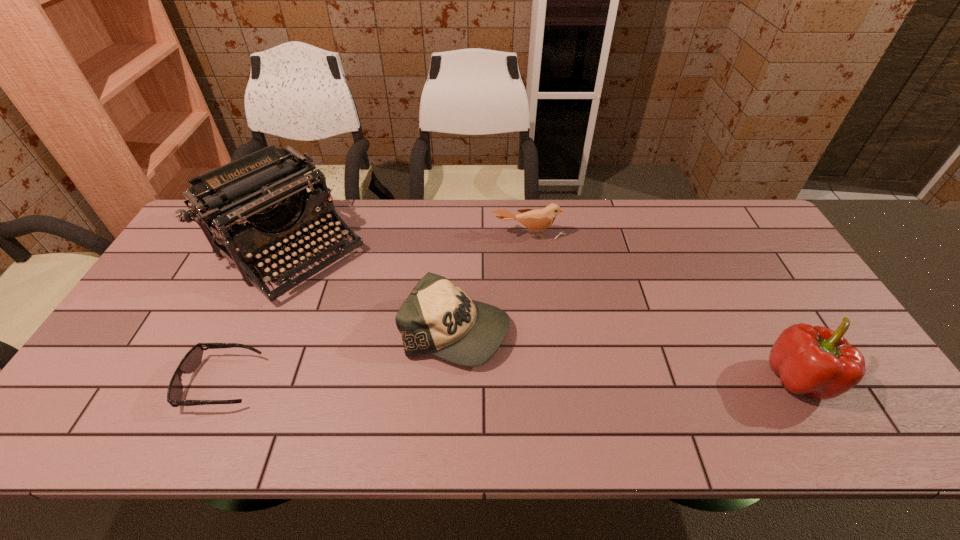
Identify the location of vacant space that is in between the rightmost object and the tallest object. The width and height of the screenshot is (960, 540). (544, 314).

The height and width of the screenshot is (540, 960). I want to click on free space between the typewriter and the bird, so click(409, 242).

Locate an element on the screen. The width and height of the screenshot is (960, 540). empty space between the pepper and the typewriter is located at coordinates (544, 314).

Identify the location of empty space that is in between the second tallest object and the tallest object. This screenshot has width=960, height=540. (544, 314).

Image resolution: width=960 pixels, height=540 pixels. I want to click on vacant point located between the rightmost object and the baseball cap, so click(628, 354).

Locate an element on the screen. This screenshot has width=960, height=540. vacant point located between the typewriter and the shortest object is located at coordinates (255, 315).

Locate an element on the screen. vacant area that lies between the shortest object and the fourth shortest object is located at coordinates (511, 380).

At what (x,y) coordinates should I click in order to perform the action: click on empty location between the shortest object and the fourth shortest object. Please return your answer as a coordinate pair (x, y). The height and width of the screenshot is (540, 960). Looking at the image, I should click on (511, 380).

Locate an element on the screen. blank region between the sunglasses and the tallest object is located at coordinates (255, 315).

Image resolution: width=960 pixels, height=540 pixels. What are the coordinates of `empty space between the bird and the typewriter` in the screenshot? It's located at (409, 242).